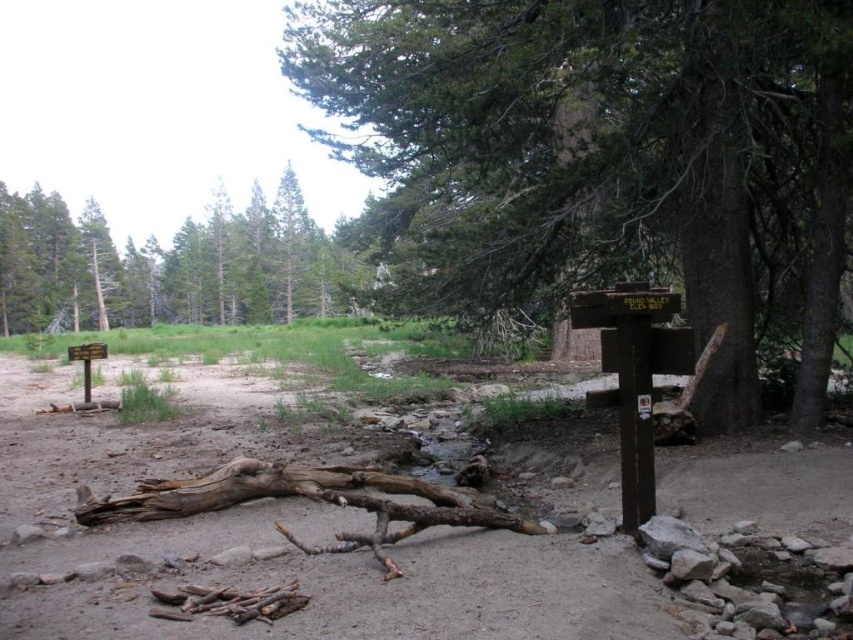
You are planning to set up a tent in this area and need to choose between placing it near the smooth brown tree trunk at center or the brown dirt track at center. Based on their sizes, which location offers more space for your tent setup?

The smooth brown tree trunk at center is larger in size than the brown dirt track at center, so placing the tent near the brown dirt track at center would provide more space for setup since it is smaller and takes up less area.